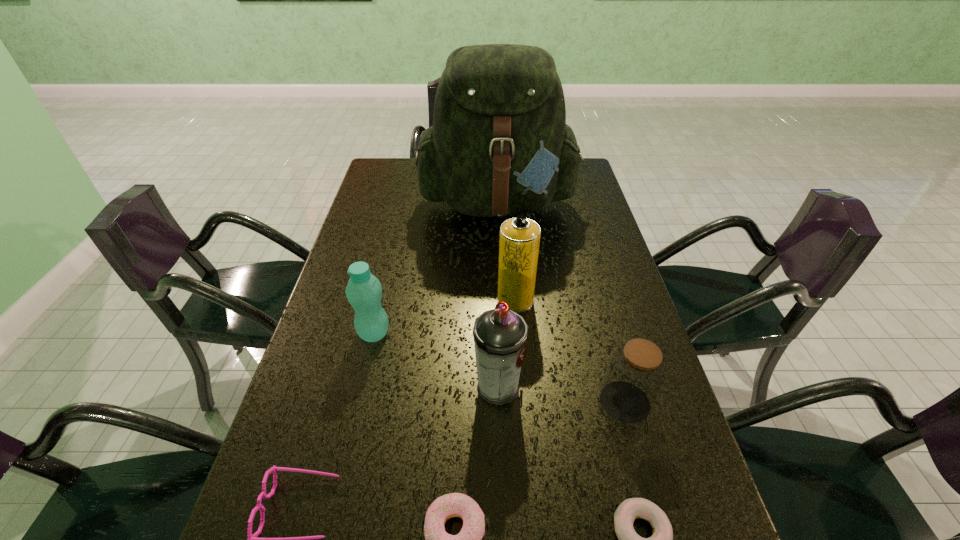
Identify the location of vacant region between the nearer aerosol can and the jar. The height and width of the screenshot is (540, 960). (562, 394).

Image resolution: width=960 pixels, height=540 pixels. What are the coordinates of `vacant area that lies between the fourth shortest object and the nearer aerosol can` in the screenshot? It's located at (562, 394).

This screenshot has width=960, height=540. Identify the location of the third closest object to the tallest object. (500, 334).

Locate which object ranks third in proximity to the second farthest object. Please provide its 2D coordinates. Your answer should be formatted as a tuple, i.e. [(x, y)], where the tuple contains the x and y coordinates of a point satisfying the conditions above.

[(635, 375)]

Identify the location of vacant space that satisfies the following two spatial constraints: 1. on the front side of the nearer aerosol can; 2. on the right side of the fourth tallest object. (362, 387).